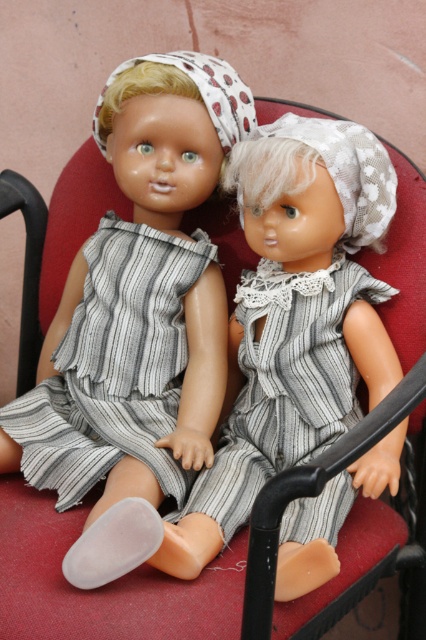
Between gray striped fabric dress at left and striped fabric dress at center, which one has less height?

striped fabric dress at center

Is gray striped fabric dress at left positioned at the back of striped fabric dress at center?

That is True.

Is point (106, 380) closer to viewer compared to point (328, 365)?

That is False.

Where is `gray striped fabric dress at left`? The image size is (426, 640). gray striped fabric dress at left is located at coordinates (115, 365).